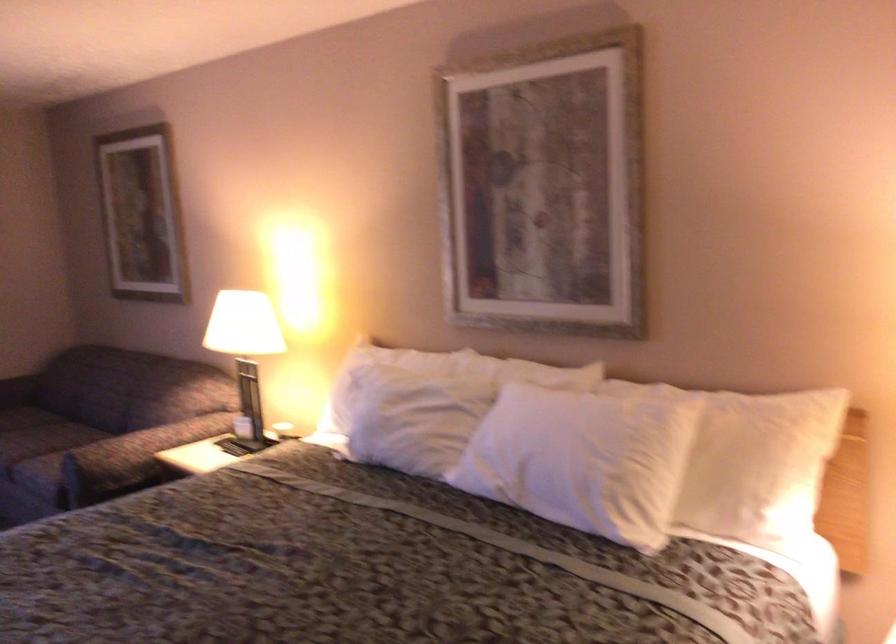
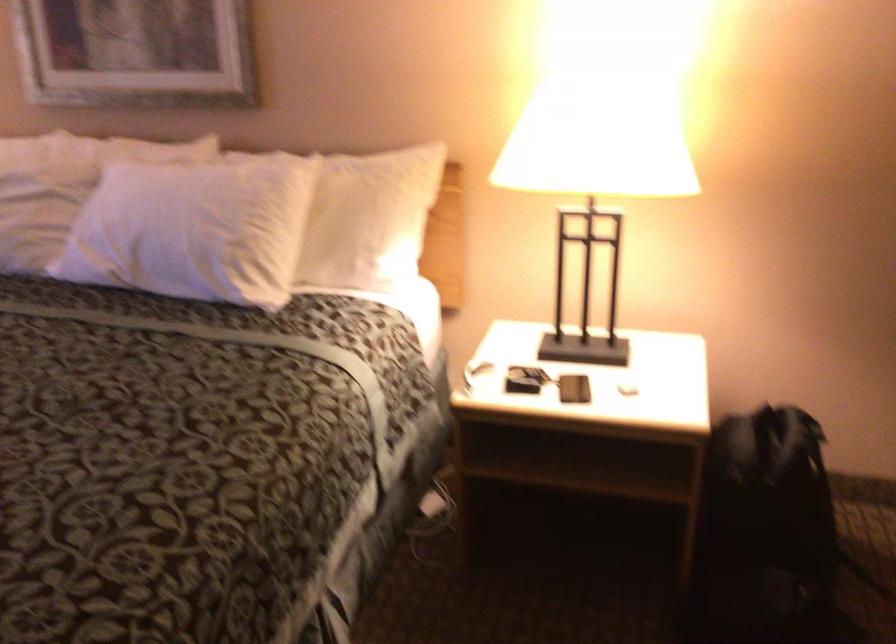
Question: The camera is either moving clockwise (left) or counter-clockwise (right) around the object. The first image is from the beginning of the video and the second image is from the end. Is the camera moving left or right when shooting the video?

Choices:
 (A) Left
 (B) Right

Answer: (A)